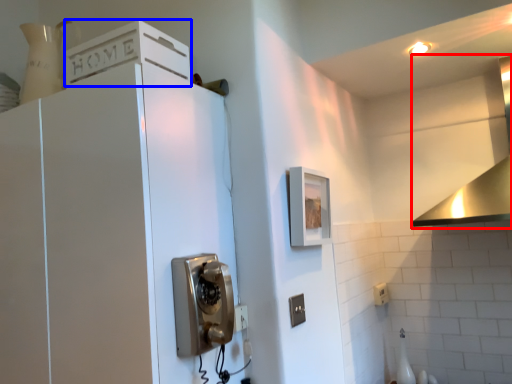
Question: Which object appears closest to the camera in this image, vent (highlighted by a red box) or cabinetry (highlighted by a blue box)?

Choices:
 (A) vent
 (B) cabinetry

Answer: (B)